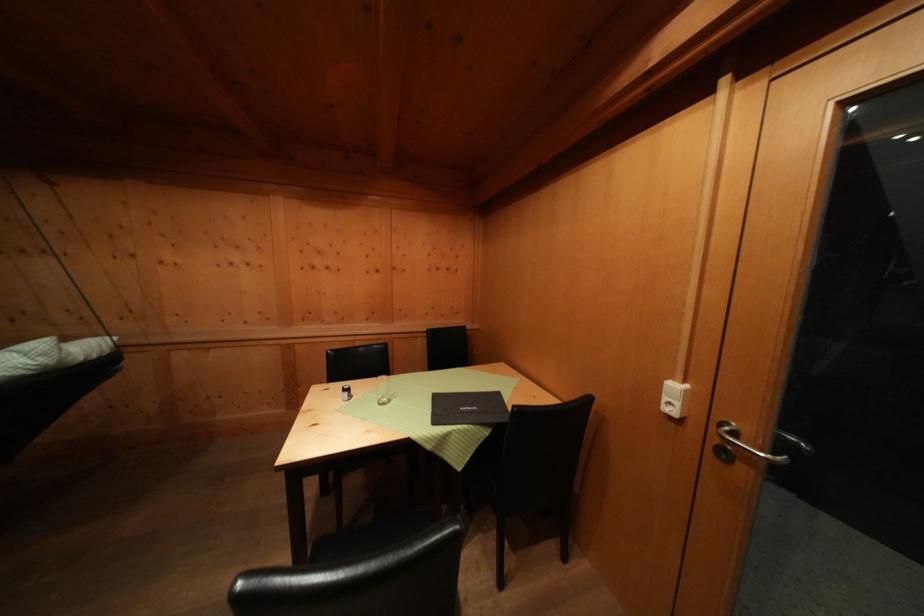
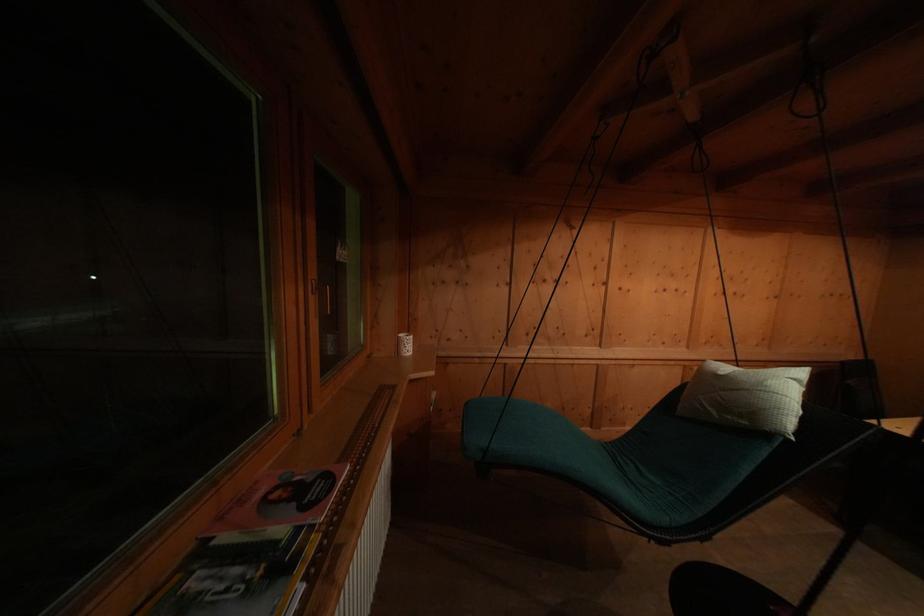
Question: The images are taken continuously from a first-person perspective. In which direction are you moving?

Choices:
 (A) Left
 (B) Right
 (C) Forward
 (D) Backward

Answer: (A)